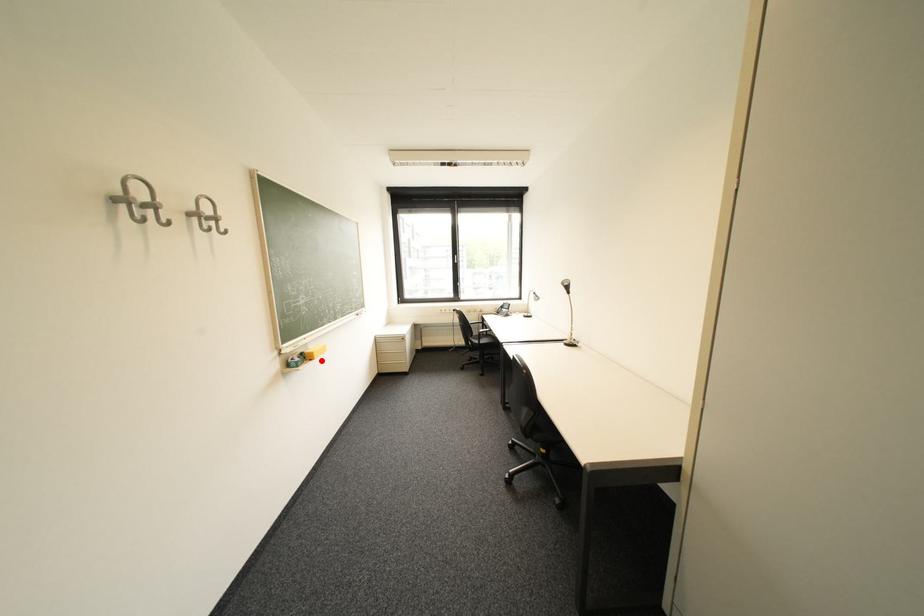
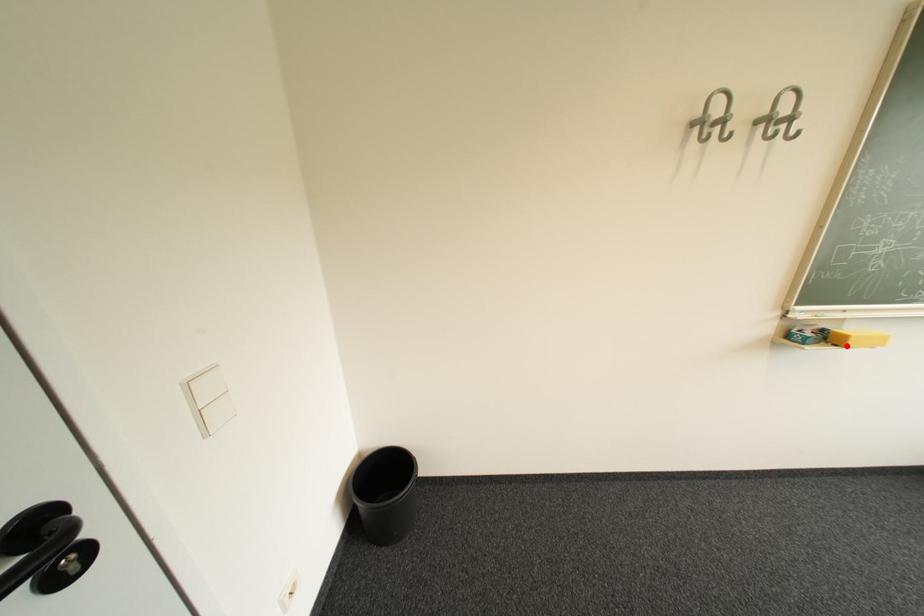
I am providing you with two images of the same scene from different viewpoints. A red point is marked on the first image and another point is marked on the second image. Do the highlighted points in image1 and image2 indicate the same real-world spot?

Yes